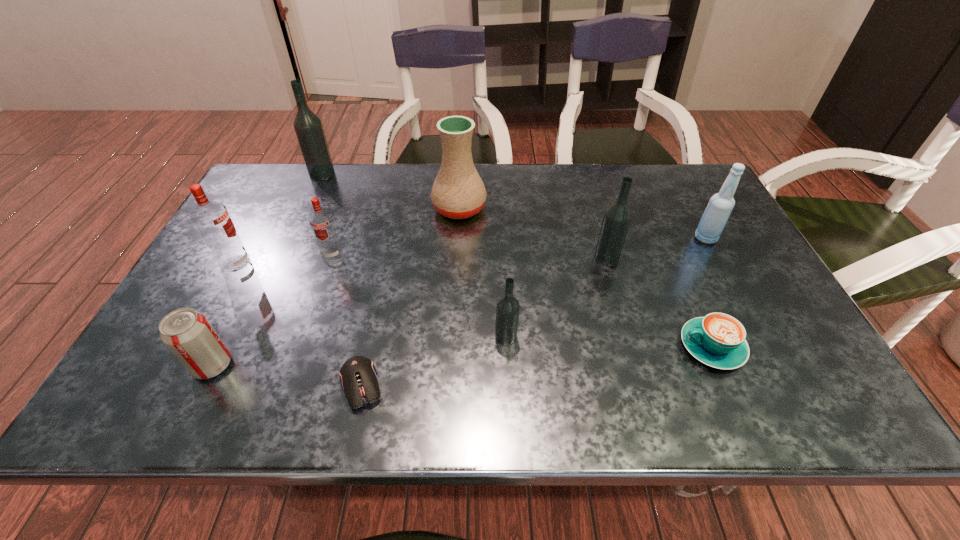
Select which black vodka appears as the third closest to the sixth object from right to left. Please provide its 2D coordinates. Your answer should be formatted as a tuple, i.e. [(x, y)], where the tuple contains the x and y coordinates of a point satisfying the conditions above.

[(308, 127)]

At what (x,y) coordinates should I click in order to perform the action: click on black vodka that stands as the closest to the second smallest black vodka. Please return your answer as a coordinate pair (x, y). This screenshot has width=960, height=540. Looking at the image, I should click on (507, 309).

Locate an element on the screen. The height and width of the screenshot is (540, 960). vacant space that satisfies the following two spatial constraints: 1. on the front label of the left red vodka; 2. on the left side of the shortest object is located at coordinates (170, 386).

Where is `vacant position in the image that satisfies the following two spatial constraints: 1. on the front label of the bigger red vodka; 2. on the right side of the second vodka from right to left`? The image size is (960, 540). vacant position in the image that satisfies the following two spatial constraints: 1. on the front label of the bigger red vodka; 2. on the right side of the second vodka from right to left is located at coordinates (196, 336).

Where is `vacant space that satisfies the following two spatial constraints: 1. with the handle on the right side of the second shortest object; 2. on the front side of the black computer mouse`? vacant space that satisfies the following two spatial constraints: 1. with the handle on the right side of the second shortest object; 2. on the front side of the black computer mouse is located at coordinates (729, 386).

Image resolution: width=960 pixels, height=540 pixels. In order to click on vacant space that satisfies the following two spatial constraints: 1. on the front label of the computer mouse; 2. on the right side of the fourth object from left to right in this screenshot , I will do `click(288, 386)`.